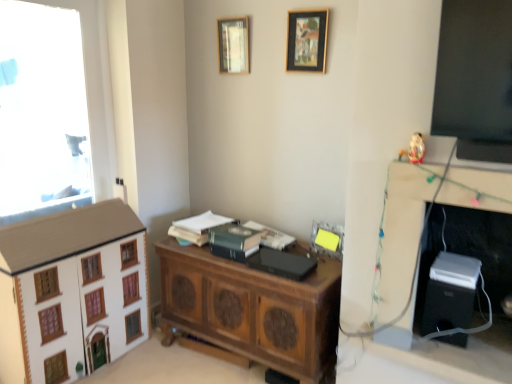
Question: Is wooden chest at center with green matte book at center, which is the fourth book in right-to-left order?

Choices:
 (A) yes
 (B) no

Answer: (B)

Question: From a real-world perspective, is wooden chest at center over green matte book at center, which is the fourth book in right-to-left order?

Choices:
 (A) yes
 (B) no

Answer: (B)

Question: Does wooden chest at center have a greater width compared to green matte book at center, which is the fourth book in right-to-left order?

Choices:
 (A) no
 (B) yes

Answer: (B)

Question: Is wooden chest at center further to camera compared to green matte book at center, which is the fourth book in right-to-left order?

Choices:
 (A) no
 (B) yes

Answer: (A)

Question: Considering the relative sizes of wooden chest at center and green matte book at center, which is the fourth book in right-to-left order, in the image provided, is wooden chest at center bigger than green matte book at center, which is the fourth book in right-to-left order,?

Choices:
 (A) no
 (B) yes

Answer: (B)

Question: Is wooden chest at center facing away from green matte book at center, placed as the first book when sorted from left to right?

Choices:
 (A) no
 (B) yes

Answer: (A)

Question: Considering the relative positions of black plastic computer desk at right and porcelain white figurine at upper right in the image provided, is black plastic computer desk at right to the right of porcelain white figurine at upper right from the viewer's perspective?

Choices:
 (A) yes
 (B) no

Answer: (A)

Question: Would you say porcelain white figurine at upper right is part of black plastic computer desk at right's contents?

Choices:
 (A) yes
 (B) no

Answer: (B)

Question: Would you consider black plastic computer desk at right to be distant from porcelain white figurine at upper right?

Choices:
 (A) no
 (B) yes

Answer: (A)

Question: Is black plastic computer desk at right behind porcelain white figurine at upper right?

Choices:
 (A) yes
 (B) no

Answer: (B)

Question: From a real-world perspective, is black plastic computer desk at right physically above porcelain white figurine at upper right?

Choices:
 (A) yes
 (B) no

Answer: (B)

Question: From a real-world perspective, is black plastic computer desk at right positioned under porcelain white figurine at upper right based on gravity?

Choices:
 (A) no
 (B) yes

Answer: (B)

Question: Is wooden chest at center thinner than green matte book at center, which is the 2th book in left-to-right order?

Choices:
 (A) no
 (B) yes

Answer: (A)